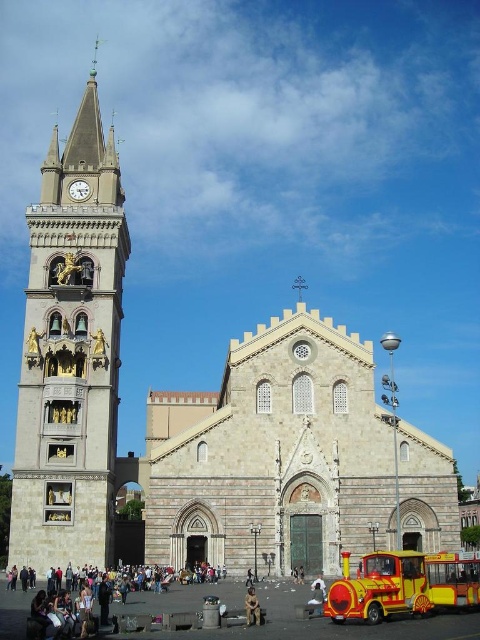
Question: Is brick pavement at lower center to the right of camouflage fabric person at lower center from the viewer's perspective?

Choices:
 (A) no
 (B) yes

Answer: (A)

Question: Among these objects, which one is nearest to the camera?

Choices:
 (A) light beige stone church at center
 (B) brick pavement at lower center
 (C) camouflage fabric person at lower center

Answer: (B)

Question: Where is brick pavement at lower center located in relation to yellow painted metal tour bus at lower right in the image?

Choices:
 (A) right
 (B) left

Answer: (B)

Question: Which point is farther to the camera?

Choices:
 (A) brick pavement at lower center
 (B) dark gray stone person at lower left

Answer: (A)

Question: Can you confirm if stone clock tower at left is positioned to the left of yellow painted metal tour bus at lower right?

Choices:
 (A) yes
 (B) no

Answer: (A)

Question: Among these objects, which one is farthest from the camera?

Choices:
 (A) yellow painted metal tour bus at lower right
 (B) light beige stone church at center
 (C) brick pavement at lower center

Answer: (B)